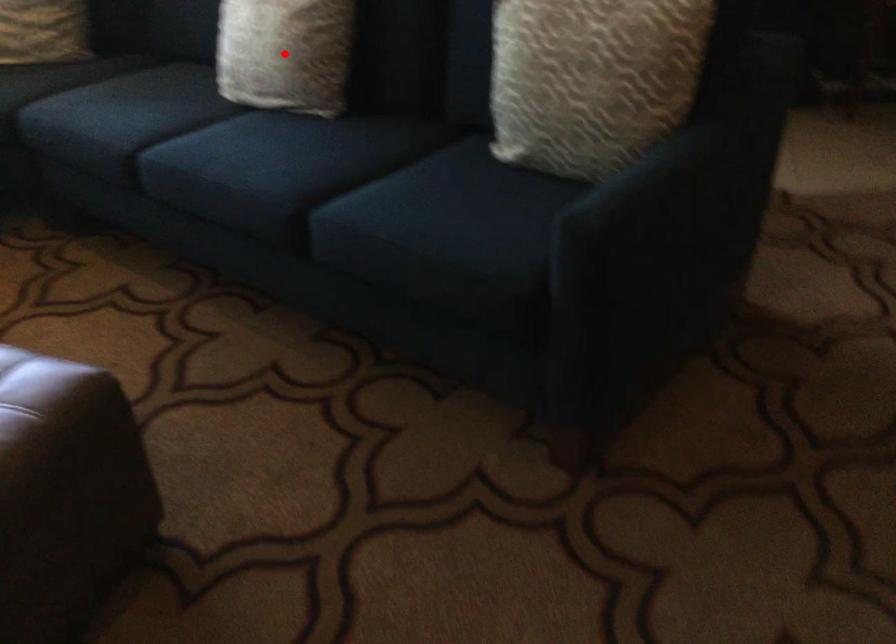
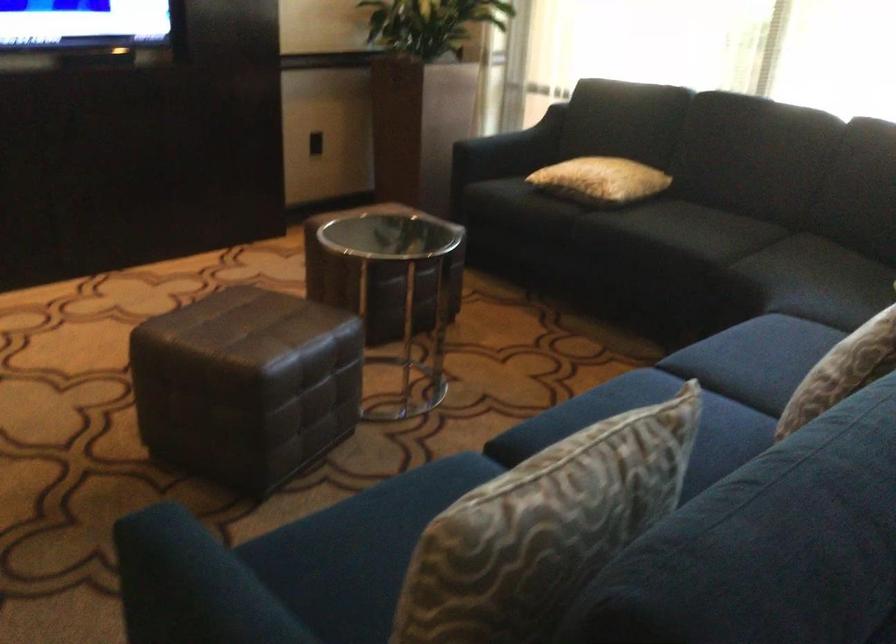
Question: I am providing you with two images of the same scene from different viewpoints. A red point is marked on the first image. Can you still see the location of the red point in image 2?

Choices:
 (A) Yes
 (B) No

Answer: (B)